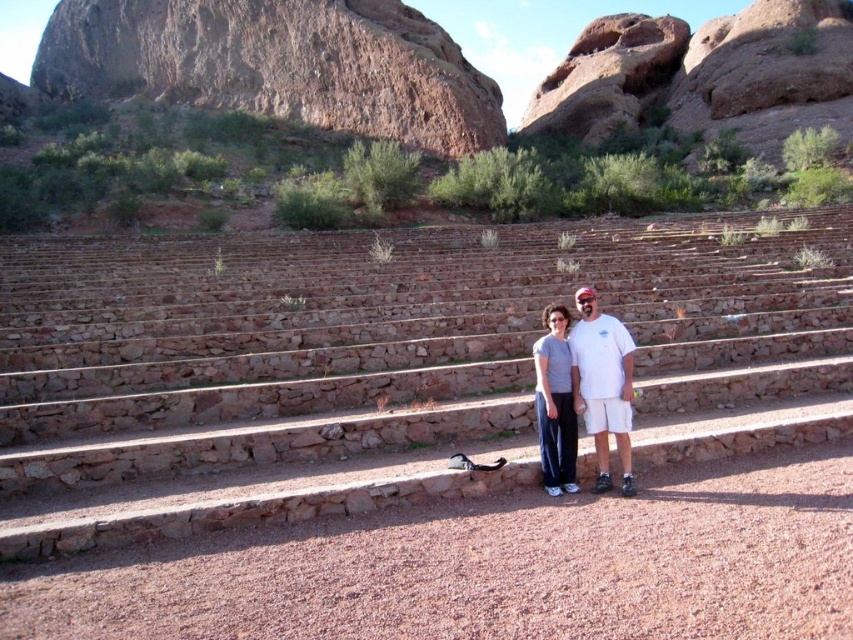
Is white cotton t-shirt at center smaller than matte gray pants at center?

Actually, white cotton t-shirt at center might be larger than matte gray pants at center.

Describe the element at coordinates (602, 385) in the screenshot. This screenshot has height=640, width=853. I see `white cotton t-shirt at center` at that location.

Identify the location of white cotton t-shirt at center. The image size is (853, 640). (602, 385).

Who is more distant from viewer, (473, 422) or (621, 340)?

Point (473, 422)

Is point (207, 296) closer to viewer compared to point (616, 346)?

That is False.

Locate an element on the screen. The image size is (853, 640). brown stone stairs at center is located at coordinates (387, 369).

Where is `brown stone stairs at center`? brown stone stairs at center is located at coordinates (387, 369).

Which is above, brown stone stairs at center or matte gray pants at center?

Positioned higher is brown stone stairs at center.

From the picture: Which is below, brown stone stairs at center or matte gray pants at center?

Positioned lower is matte gray pants at center.

Locate an element on the screen. This screenshot has height=640, width=853. brown stone stairs at center is located at coordinates (387, 369).

Locate an element on the screen. This screenshot has height=640, width=853. brown stone stairs at center is located at coordinates (387, 369).